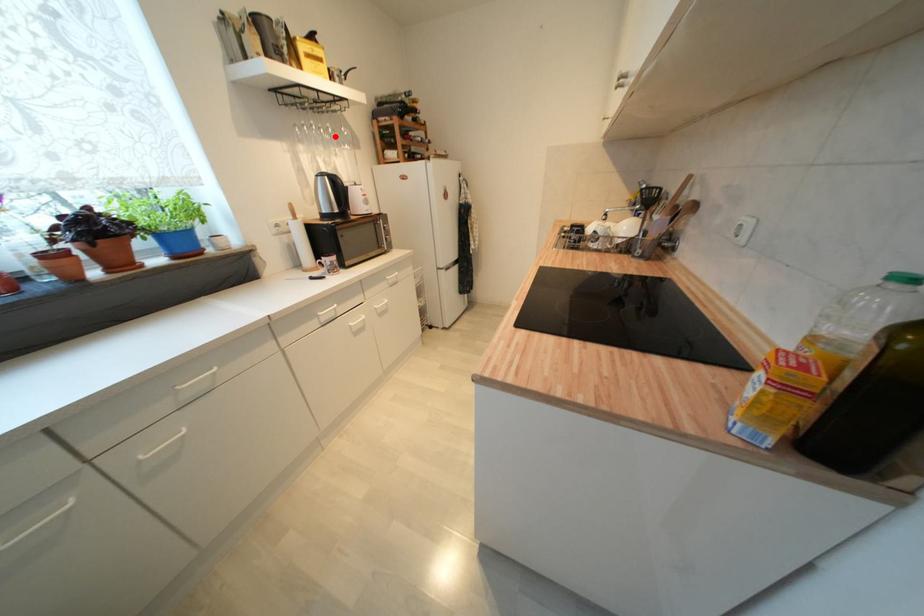
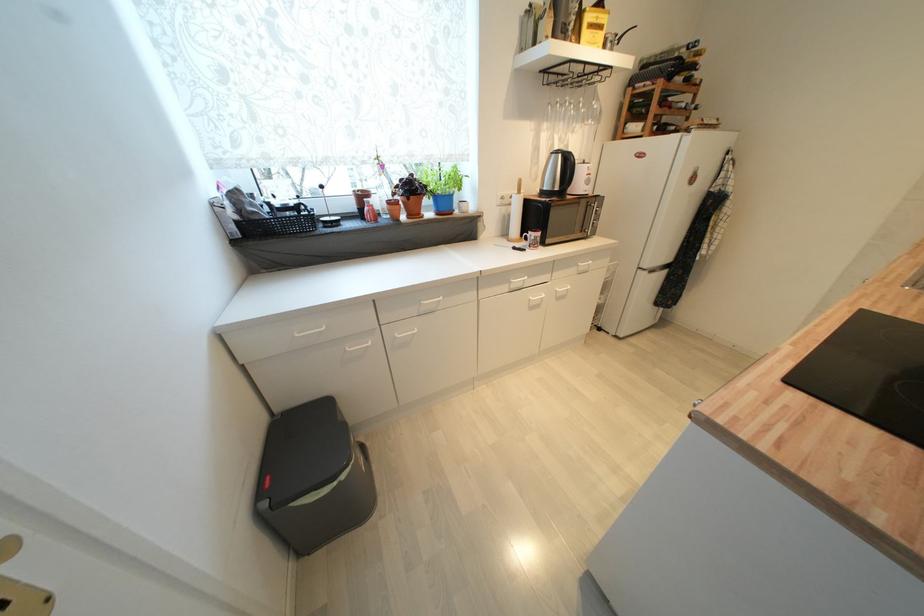
Find the pixel in the second image that matches the highlighted location in the first image.

(582, 111)